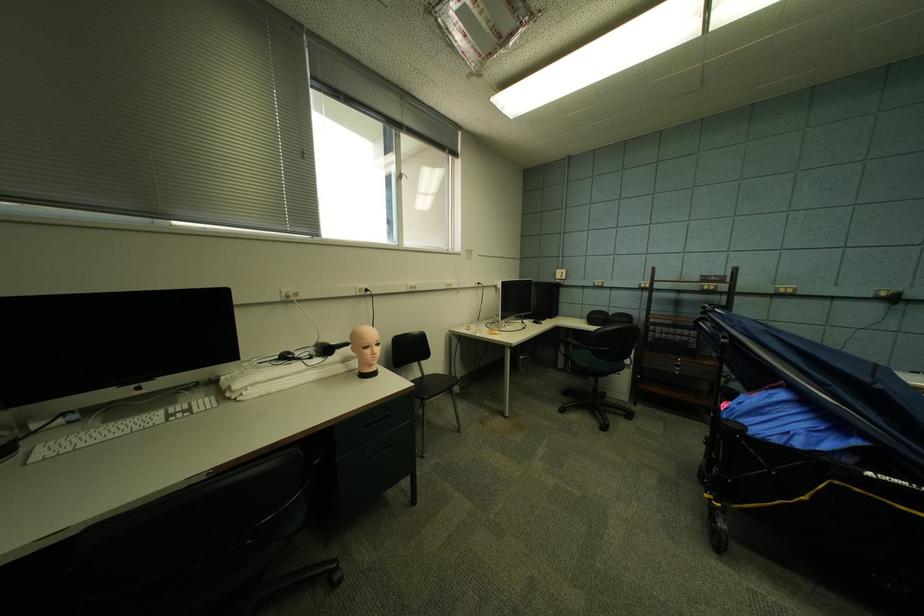
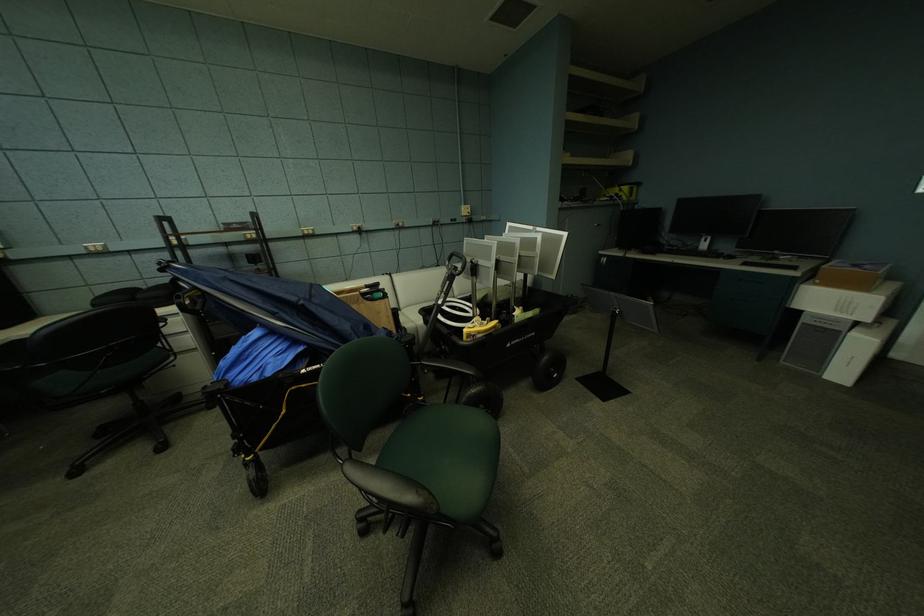
How did the camera likely rotate?

The camera rotated toward right-down.